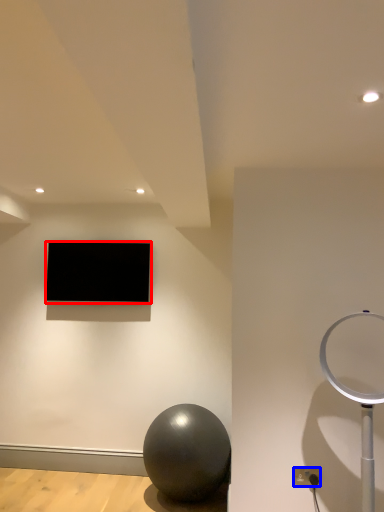
Question: Which of the following is the closest to the observer, television (highlighted by a red box) or electric outlet (highlighted by a blue box)?

Choices:
 (A) television
 (B) electric outlet

Answer: (B)